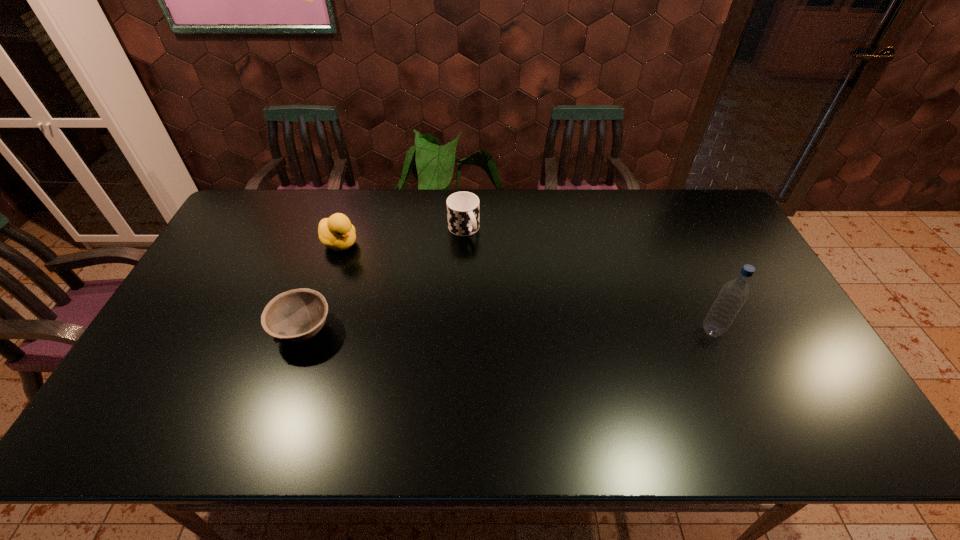
You are a GUI agent. You are given a task and a screenshot of the screen. Output one action in this format:
    pyautogui.click(x=<x>, y=<y>)
    Task: Click on the shortest object
    Image resolution: width=960 pixels, height=540 pixels.
    Given the screenshot: What is the action you would take?
    pyautogui.click(x=294, y=316)

At what (x,y) coordinates should I click in order to perform the action: click on the tallest object. Please return your answer as a coordinate pair (x, y). This screenshot has width=960, height=540. Looking at the image, I should click on (733, 294).

Find the location of a particular element. the rightmost object is located at coordinates (733, 294).

Where is `the third tallest object`? This screenshot has height=540, width=960. the third tallest object is located at coordinates (462, 207).

Where is `the third object from left to right`? This screenshot has height=540, width=960. the third object from left to right is located at coordinates (462, 207).

Image resolution: width=960 pixels, height=540 pixels. Find the location of `the second tallest object`. the second tallest object is located at coordinates (336, 232).

Where is `free space located on the back of the bowl`? The width and height of the screenshot is (960, 540). free space located on the back of the bowl is located at coordinates (336, 237).

At what (x,y) coordinates should I click in order to perform the action: click on vacant region located on the left of the rightmost object. Please return your answer as a coordinate pair (x, y). This screenshot has width=960, height=540. Looking at the image, I should click on (568, 330).

Find the location of `free location located on the side of the third object from left to right with the handle`. free location located on the side of the third object from left to right with the handle is located at coordinates (498, 281).

At what (x,y) coordinates should I click in order to perform the action: click on vacant space located on the side of the third object from left to right with the handle. Please return your answer as a coordinate pair (x, y). Looking at the image, I should click on (508, 294).